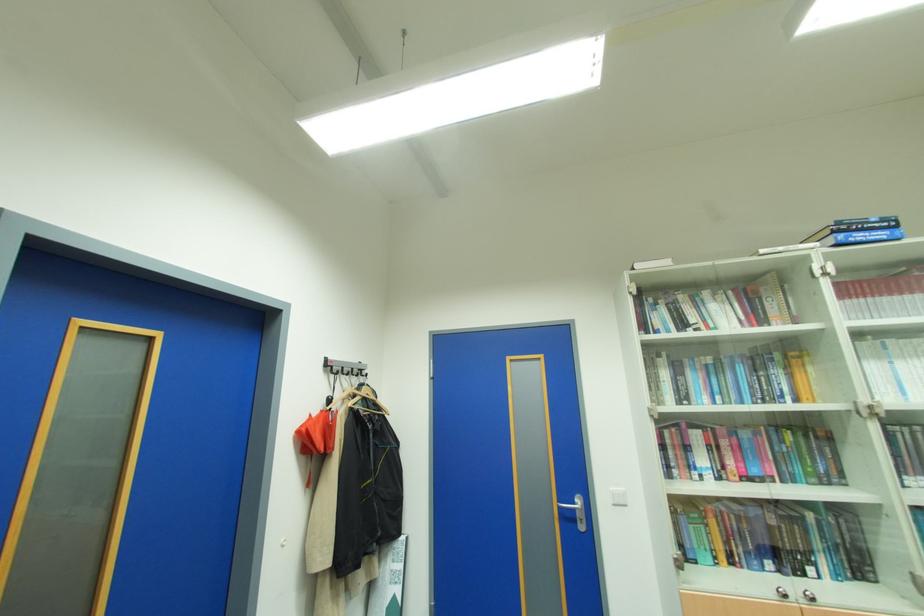
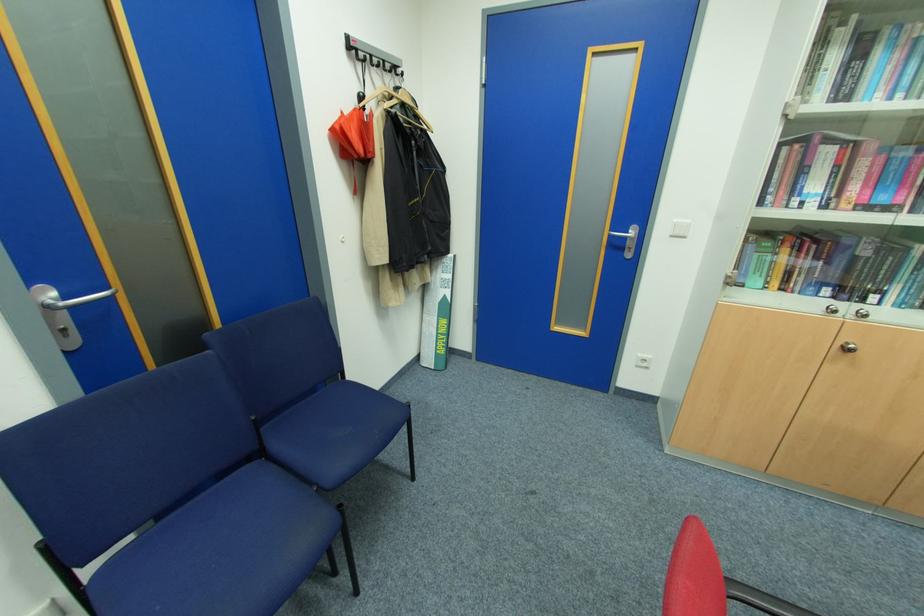
Where in the second image is the point corresponding to point 330,371 from the first image?

(353, 55)